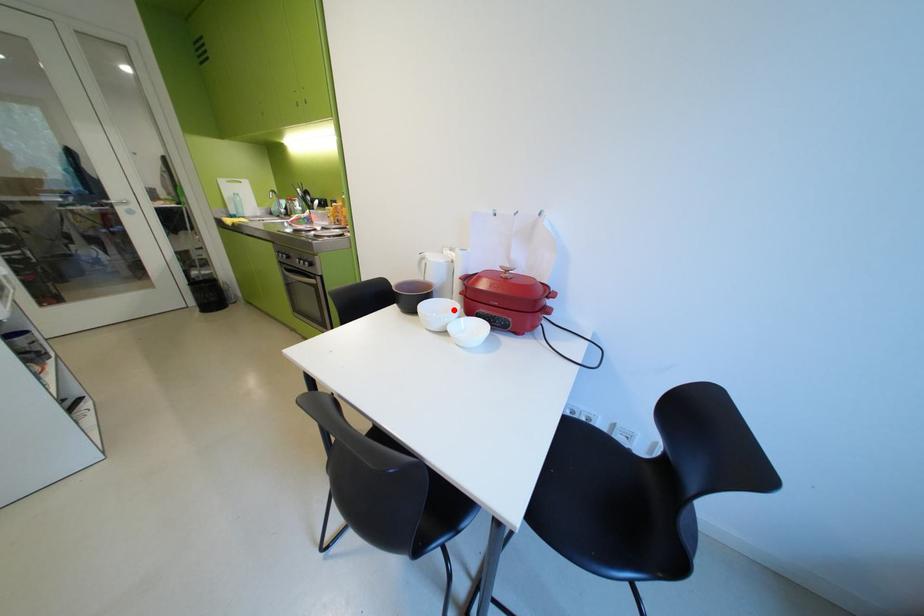
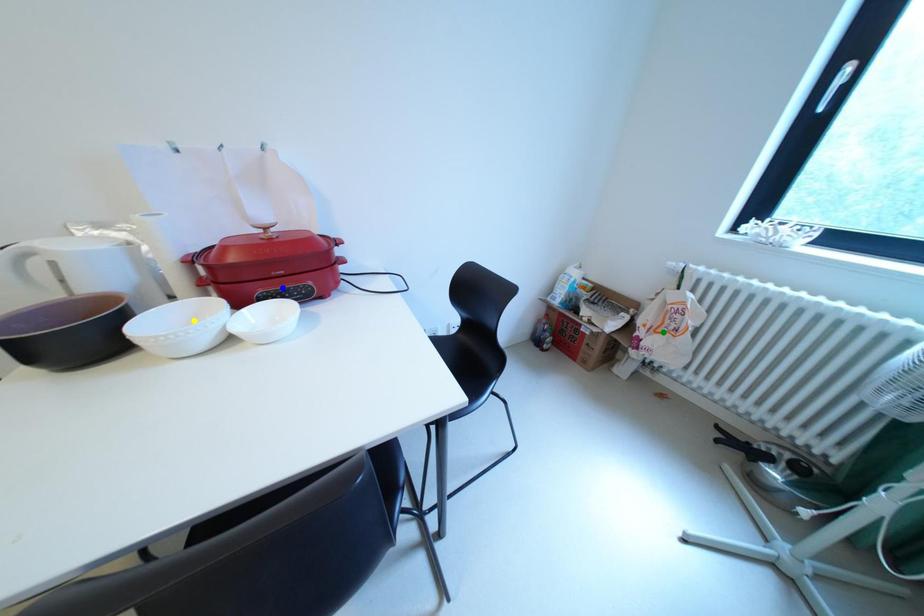
Question: I am providing you with two images of the same scene from different viewpoints. A red point is marked on the first image. You are given multiple points on the second image. Which mark in image 2 goes with the point in image 1?

Choices:
 (A) blue point
 (B) yellow point
 (C) green point

Answer: (B)